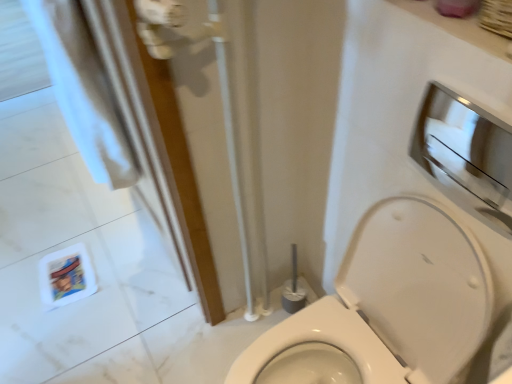
Question: Should I look upward or downward to see white glossy toilet at center?

Choices:
 (A) up
 (B) down

Answer: (B)

Question: Considering the relative sizes of metallic silver medicine cabinet at upper right and white glossy toilet at center in the image provided, is metallic silver medicine cabinet at upper right shorter than white glossy toilet at center?

Choices:
 (A) yes
 (B) no

Answer: (A)

Question: Can you confirm if metallic silver medicine cabinet at upper right is positioned to the left of white glossy toilet at center?

Choices:
 (A) yes
 (B) no

Answer: (B)

Question: Is metallic silver medicine cabinet at upper right positioned far away from white glossy toilet at center?

Choices:
 (A) no
 (B) yes

Answer: (A)

Question: From the image's perspective, is metallic silver medicine cabinet at upper right located beneath white glossy toilet at center?

Choices:
 (A) no
 (B) yes

Answer: (A)

Question: Is metallic silver medicine cabinet at upper right outside of white glossy toilet at center?

Choices:
 (A) no
 (B) yes

Answer: (B)

Question: Is metallic silver medicine cabinet at upper right smaller than white glossy toilet at center?

Choices:
 (A) no
 (B) yes

Answer: (B)

Question: Is the position of white glossy toilet at center less distant than that of metallic silver medicine cabinet at upper right?

Choices:
 (A) no
 (B) yes

Answer: (B)

Question: Is white glossy toilet at center positioned with its back to metallic silver medicine cabinet at upper right?

Choices:
 (A) yes
 (B) no

Answer: (B)

Question: Can you confirm if white glossy toilet at center is bigger than metallic silver medicine cabinet at upper right?

Choices:
 (A) yes
 (B) no

Answer: (A)

Question: Is metallic silver medicine cabinet at upper right inside white glossy toilet at center?

Choices:
 (A) yes
 (B) no

Answer: (B)

Question: From a real-world perspective, is white glossy toilet at center below metallic silver medicine cabinet at upper right?

Choices:
 (A) no
 (B) yes

Answer: (B)

Question: Does white glossy toilet at center touch metallic silver medicine cabinet at upper right?

Choices:
 (A) no
 (B) yes

Answer: (A)

Question: Considering the positions of white glossy toilet at center and metallic silver medicine cabinet at upper right in the image, is white glossy toilet at center bigger or smaller than metallic silver medicine cabinet at upper right?

Choices:
 (A) big
 (B) small

Answer: (A)